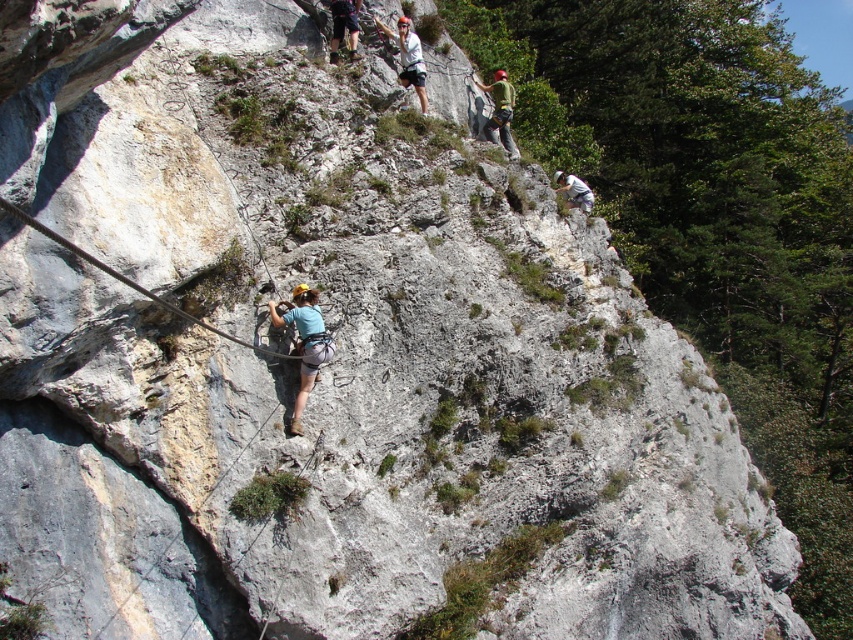
You are a climber planning to ascend the rock face shown. You notice the black wire rope at center and the white fabric at upper center. Which object takes up more area on the rock face?

The white fabric at upper center takes up more area on the rock face than the black wire rope at center.

You are a climber looking up at the rock face. You see the white matte helmet at center and the white fabric at upper center. Which object is nearer to you?

The white matte helmet at center is closer to the viewer than the white fabric at upper center.